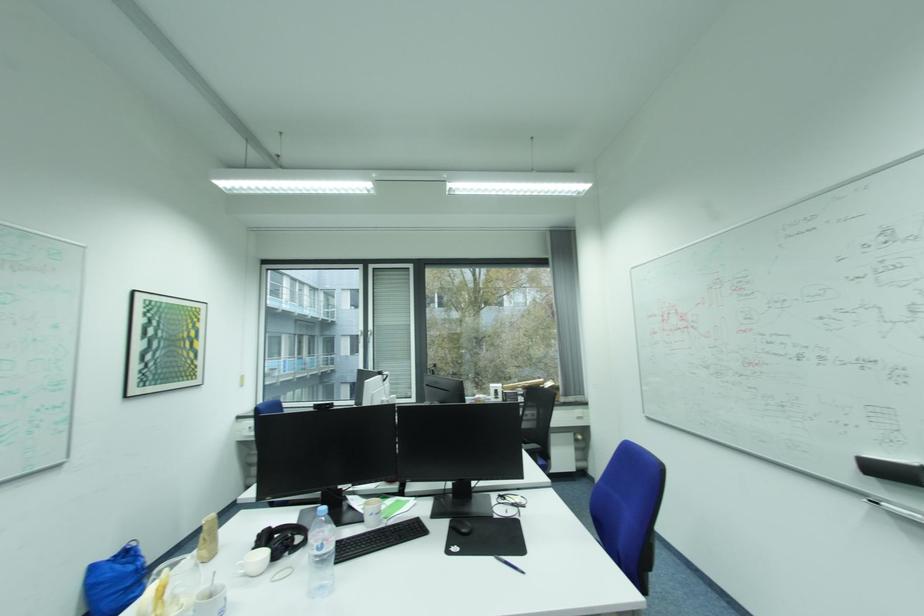
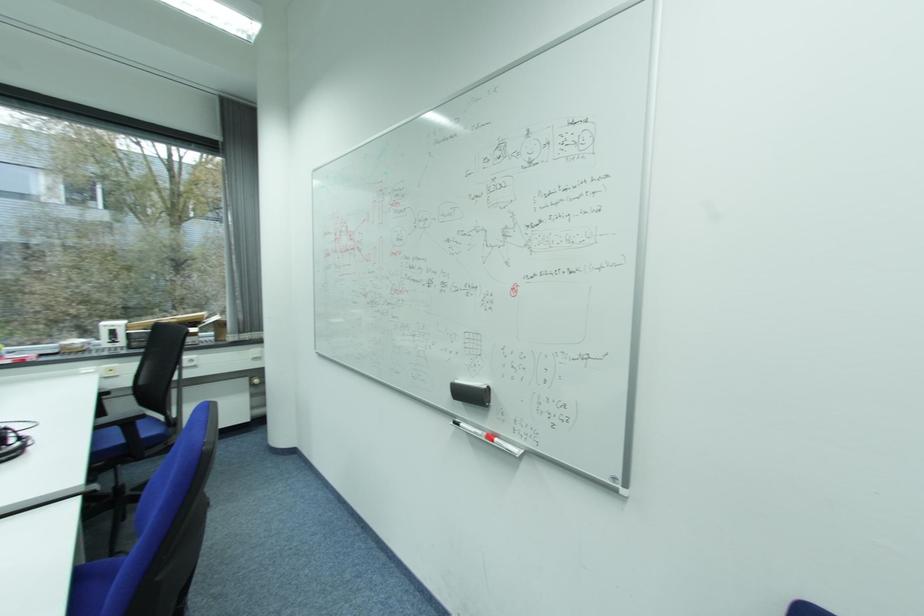
Where in the second image is the point corresponding to the point at 854,472 from the first image?

(453, 398)